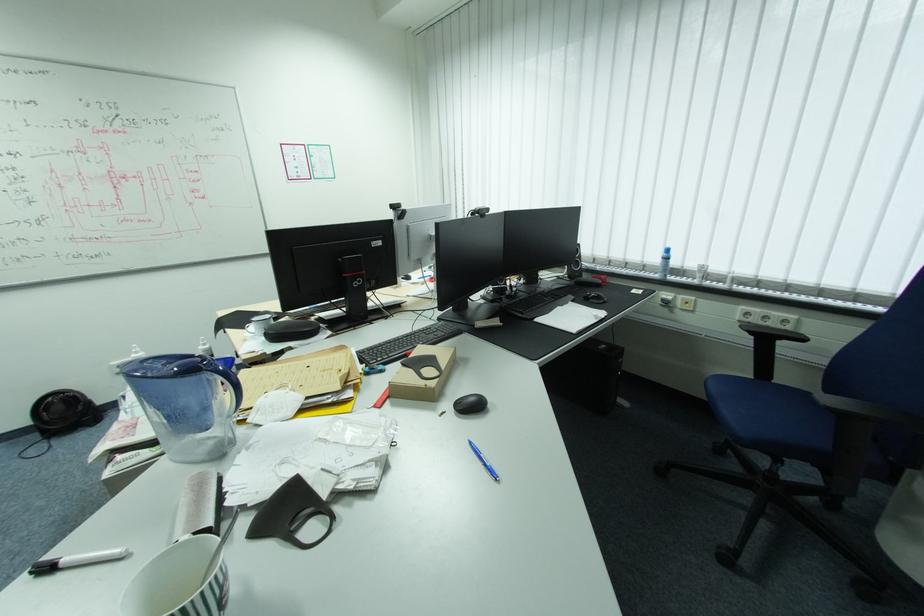
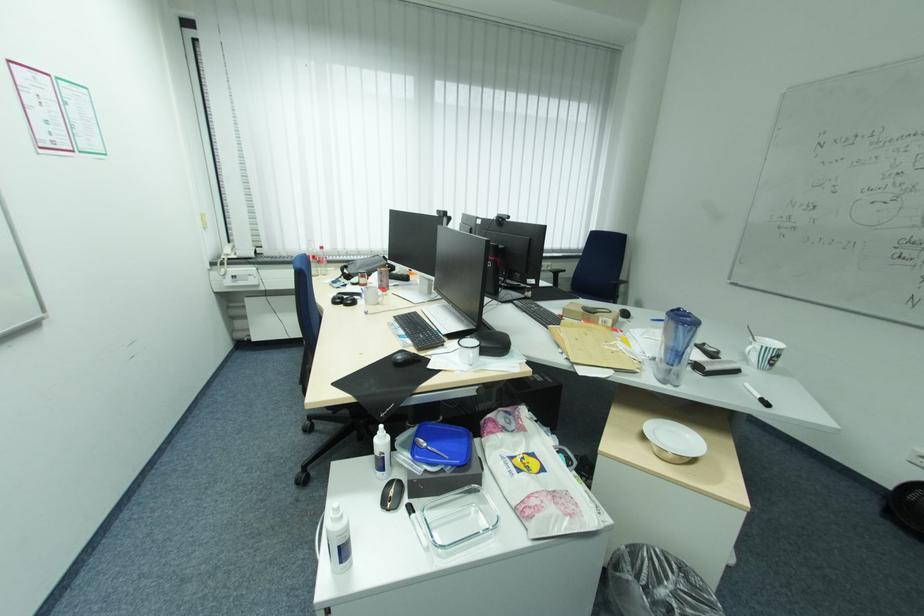
Where in the second image is the point corresponding to the point at 791,321 from the first image?

(554, 265)